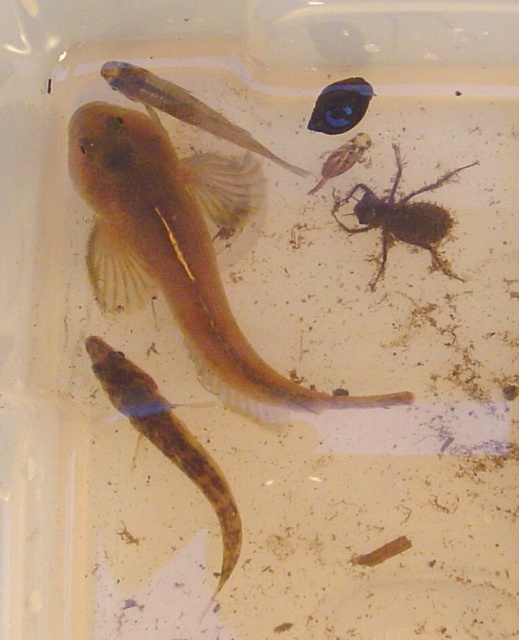
You are an aquatic biologist observing the clear plastic container. You notice the translucent gelatinous fish at bottom left and the brown fuzzy insect at upper right. Which organism is bigger in size?

The translucent gelatinous fish at bottom left is larger in size than the brown fuzzy insect at upper right.

You are an aquatic biologist observing the clear plastic container. You notice the translucent gelatinous fish at center and the brown fuzzy insect at upper right. Which of these two organisms is closer to the surface of the water?

The translucent gelatinous fish at center is in front of the brown fuzzy insect at upper right, meaning it is closer to the surface of the water.

You are observing the container from the front. Which of the two points, point [141,88] or point [347,124], is closer to you?

Point [141,88] is closer to you because it is in front of point [347,124].